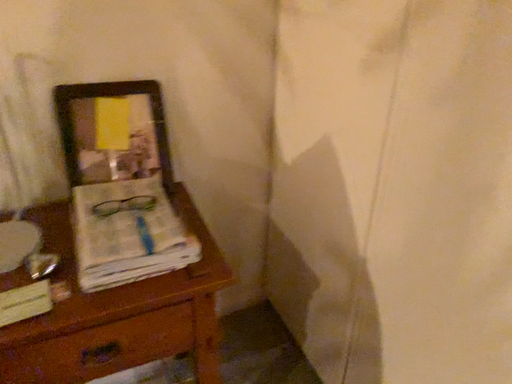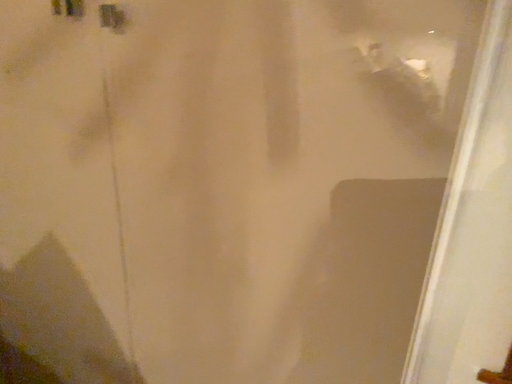
Question: Which way did the camera rotate in the video?

Choices:
 (A) rotated right
 (B) rotated left

Answer: (A)